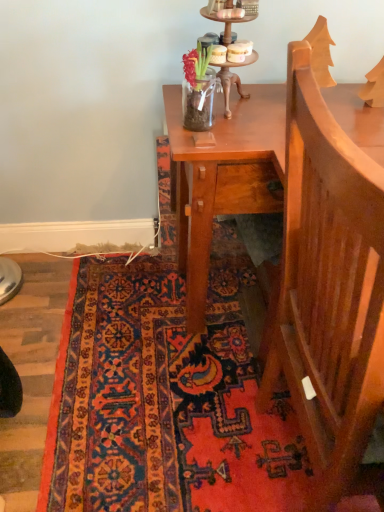
Question: In which direction should I rotate to look at carpet with intricate patterns at lower center?

Choices:
 (A) left
 (B) right

Answer: (A)

Question: Is wooden candle holder at upper center facing towards wooden armchair at right?

Choices:
 (A) yes
 (B) no

Answer: (A)

Question: From a real-world perspective, is wooden candle holder at upper center on top of wooden armchair at right?

Choices:
 (A) yes
 (B) no

Answer: (A)

Question: Does wooden candle holder at upper center have a greater height compared to wooden armchair at right?

Choices:
 (A) no
 (B) yes

Answer: (A)

Question: From a real-world perspective, is wooden candle holder at upper center located beneath wooden armchair at right?

Choices:
 (A) no
 (B) yes

Answer: (A)

Question: Does wooden candle holder at upper center have a smaller size compared to wooden armchair at right?

Choices:
 (A) no
 (B) yes

Answer: (B)

Question: Considering the relative sizes of wooden candle holder at upper center and wooden armchair at right in the image provided, is wooden candle holder at upper center thinner than wooden armchair at right?

Choices:
 (A) yes
 (B) no

Answer: (A)

Question: Is carpet with intricate patterns at lower center far away from wooden armchair at right?

Choices:
 (A) no
 (B) yes

Answer: (A)

Question: Is carpet with intricate patterns at lower center positioned with its back to wooden armchair at right?

Choices:
 (A) yes
 (B) no

Answer: (B)

Question: From the image's perspective, is carpet with intricate patterns at lower center on top of wooden armchair at right?

Choices:
 (A) yes
 (B) no

Answer: (B)

Question: Would you say carpet with intricate patterns at lower center contains wooden armchair at right?

Choices:
 (A) yes
 (B) no

Answer: (B)

Question: Is carpet with intricate patterns at lower center facing towards wooden armchair at right?

Choices:
 (A) yes
 (B) no

Answer: (B)

Question: Is carpet with intricate patterns at lower center thinner than wooden armchair at right?

Choices:
 (A) yes
 (B) no

Answer: (B)

Question: Is wooden armchair at right outside of carpet with intricate patterns at lower center?

Choices:
 (A) no
 (B) yes

Answer: (B)